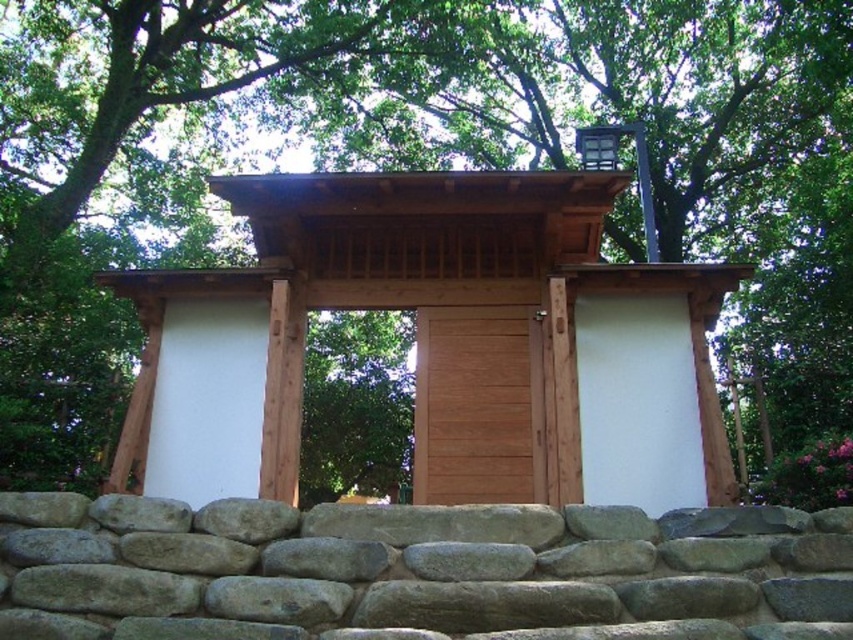
Question: Which point appears closest to the camera in this image?

Choices:
 (A) (410, 292)
 (B) (106, 621)
 (C) (415, 465)

Answer: (B)

Question: Observing the image, what is the correct spatial positioning of wooden gate at center in reference to gray rough stone wall at lower center?

Choices:
 (A) left
 (B) right

Answer: (A)

Question: In this image, where is wooden gate at center located relative to wooden door at center?

Choices:
 (A) above
 (B) below

Answer: (A)

Question: Is wooden gate at center above wooden door at center?

Choices:
 (A) yes
 (B) no

Answer: (A)

Question: Which point appears farthest from the camera in this image?

Choices:
 (A) (498, 317)
 (B) (631, 577)
 (C) (383, 216)

Answer: (C)

Question: Among these objects, which one is nearest to the camera?

Choices:
 (A) wooden door at center
 (B) gray rough stone wall at lower center

Answer: (B)